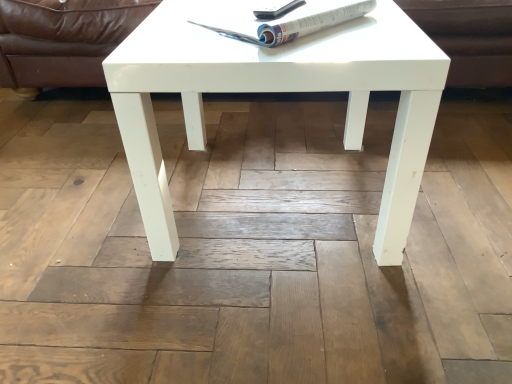
Question: Should I look upward or downward to see white glossy magazine at upper center?

Choices:
 (A) up
 (B) down

Answer: (A)

Question: Is white glossy coffee table at center touching brown leather couch at upper center?

Choices:
 (A) no
 (B) yes

Answer: (A)

Question: From a real-world perspective, does white glossy coffee table at center stand above brown leather couch at upper center?

Choices:
 (A) no
 (B) yes

Answer: (B)

Question: Is white glossy coffee table at center outside of brown leather couch at upper center?

Choices:
 (A) yes
 (B) no

Answer: (A)

Question: Is white glossy coffee table at center not near brown leather couch at upper center?

Choices:
 (A) yes
 (B) no

Answer: (B)

Question: Can you confirm if white glossy coffee table at center is thinner than brown leather couch at upper center?

Choices:
 (A) no
 (B) yes

Answer: (B)

Question: Is white glossy coffee table at center facing away from brown leather couch at upper center?

Choices:
 (A) yes
 (B) no

Answer: (B)

Question: Can you confirm if white glossy magazine at upper center is shorter than brown leather couch at upper center?

Choices:
 (A) no
 (B) yes

Answer: (B)

Question: Is white glossy magazine at upper center positioned with its back to brown leather couch at upper center?

Choices:
 (A) yes
 (B) no

Answer: (B)

Question: Is white glossy magazine at upper center facing towards brown leather couch at upper center?

Choices:
 (A) no
 (B) yes

Answer: (A)

Question: Considering the relative sizes of white glossy magazine at upper center and brown leather couch at upper center in the image provided, is white glossy magazine at upper center smaller than brown leather couch at upper center?

Choices:
 (A) no
 (B) yes

Answer: (B)

Question: Is white glossy magazine at upper center positioned far away from brown leather couch at upper center?

Choices:
 (A) no
 (B) yes

Answer: (A)

Question: Is white glossy magazine at upper center positioned before brown leather couch at upper center?

Choices:
 (A) yes
 (B) no

Answer: (A)

Question: Is white glossy magazine at upper center further to the viewer compared to white glossy coffee table at center?

Choices:
 (A) no
 (B) yes

Answer: (B)